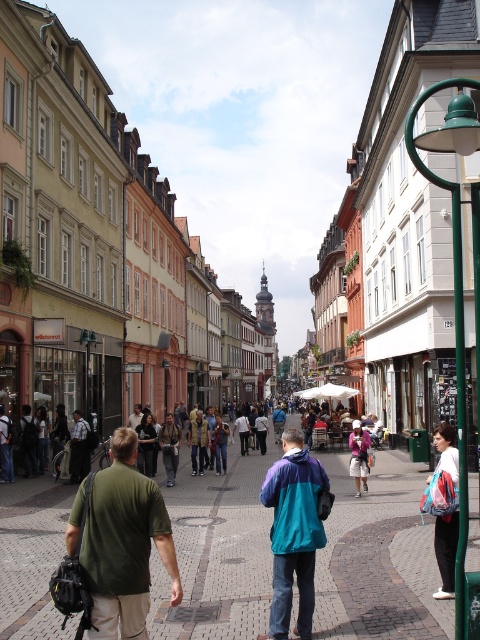
Question: Among these points, which one is farthest from the camera?

Choices:
 (A) (191, 452)
 (B) (302, 486)

Answer: (A)

Question: Which point is closer to the camera?

Choices:
 (A) (300, 584)
 (B) (194, 465)

Answer: (A)

Question: Does white cotton hoodie at lower right appear on the left side of khaki cotton pants at center?

Choices:
 (A) yes
 (B) no

Answer: (B)

Question: Does brick paved at center appear on the left side of teal/purple jacket at center?

Choices:
 (A) yes
 (B) no

Answer: (A)

Question: Does brick paved at center appear on the right side of white cotton hoodie at lower right?

Choices:
 (A) no
 (B) yes

Answer: (A)

Question: Which point is farther to the camera?

Choices:
 (A) (36, 556)
 (B) (365, 484)
 (C) (191, 440)

Answer: (C)